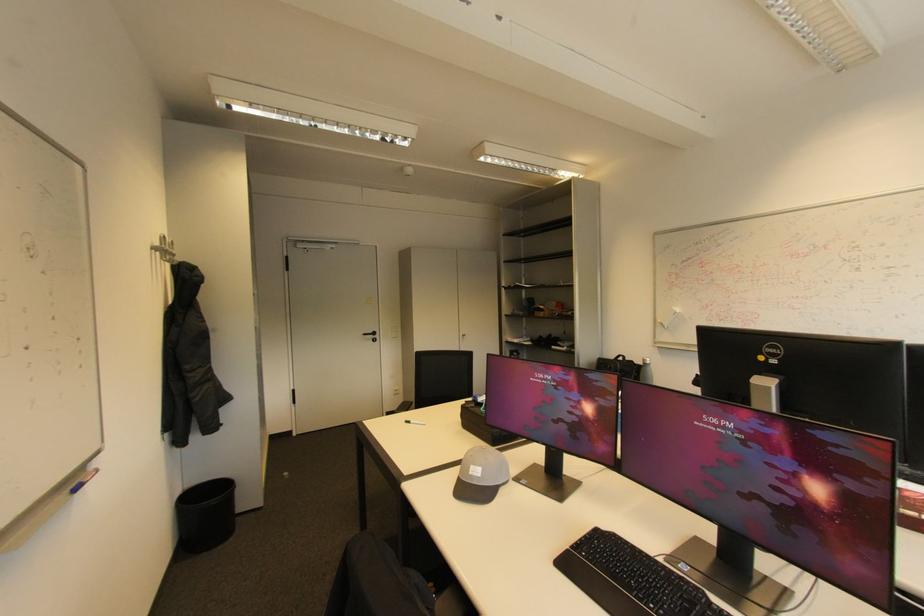
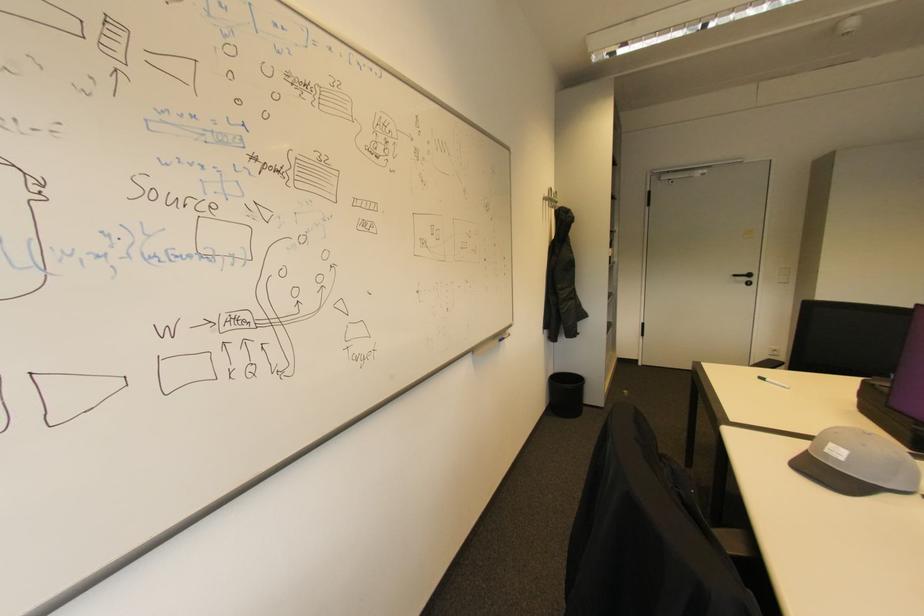
Where in the second image is the point corresponding to point 184,493 from the first image?

(555, 374)